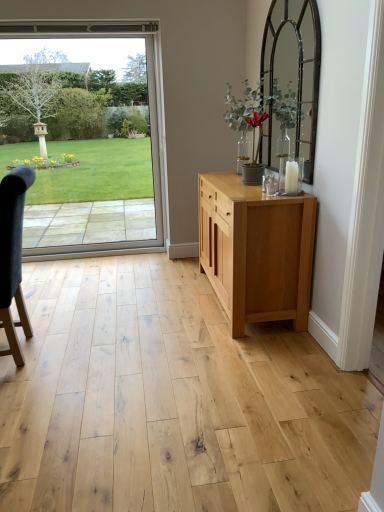
Find the location of a particular element. This screenshot has width=384, height=512. free space in front of dark gray fabric chair at left is located at coordinates (30, 386).